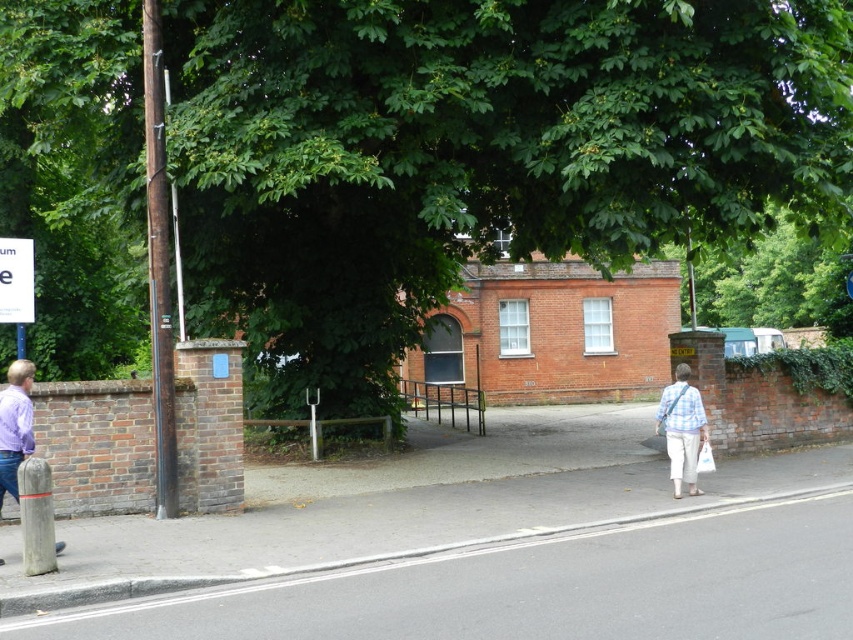
You are a pedestrian trying to get to the building with the dark wooden door. You see the green leafy tree at upper center and the white plastic sign at upper left. Which object is closer to the building?

The green leafy tree at upper center is closer to the building because it is taller than the white plastic sign at upper left.

You are a delivery person who needs to place a large package on the gray concrete pavement at lower center. However, there is a white plastic sign at upper left nearby. Which object has enough space to accommodate the package?

The gray concrete pavement at lower center is bigger than the white plastic sign at upper left, so the gray concrete pavement at lower center has enough space to accommodate the package.

You are a pedestrian on the sidewalk. You see a plaid shirt and pants at lower right and a white plastic sign at upper left. Which object is closer to the road?

The plaid shirt and pants at lower right are closer to the road because they are positioned to the right of the white plastic sign at upper left, which is further away from the road.